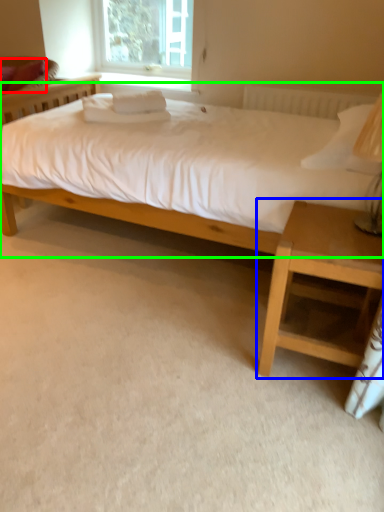
Question: Which object is the closest to the pillow (highlighted by a red box)? Choose among these: nightstand (highlighted by a blue box) or bed (highlighted by a green box).

Choices:
 (A) nightstand
 (B) bed

Answer: (B)